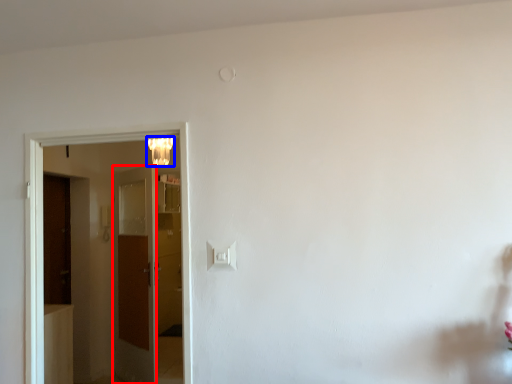
Question: Which object is further to the camera taking this photo, door (highlighted by a red box) or lamp (highlighted by a blue box)?

Choices:
 (A) door
 (B) lamp

Answer: (A)